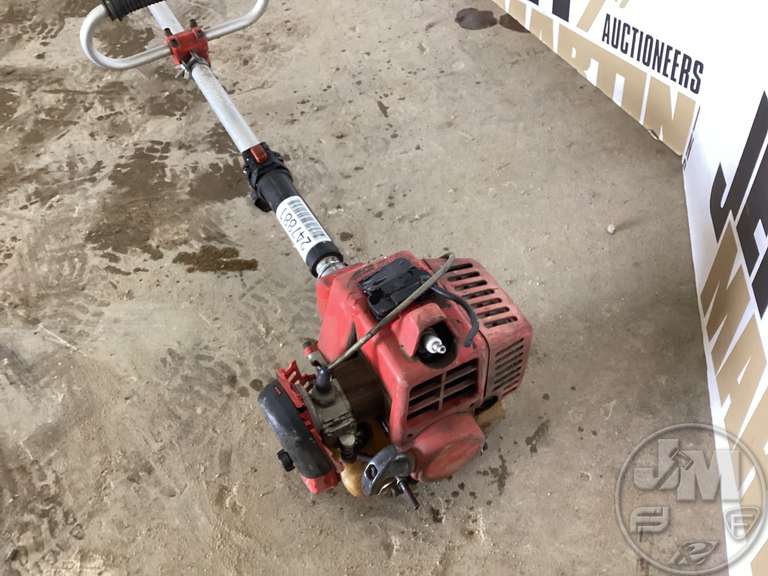
What are the coordinates of `uncovered floor` in the screenshot? It's located at (143, 170), (232, 192), (210, 264), (127, 231), (42, 134), (7, 98), (136, 37), (8, 3), (35, 484), (42, 439).